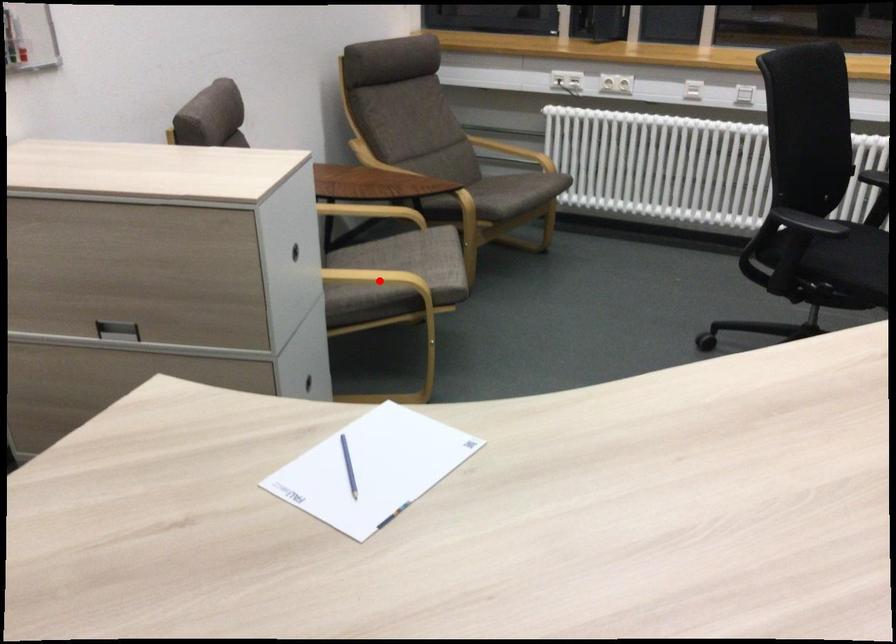
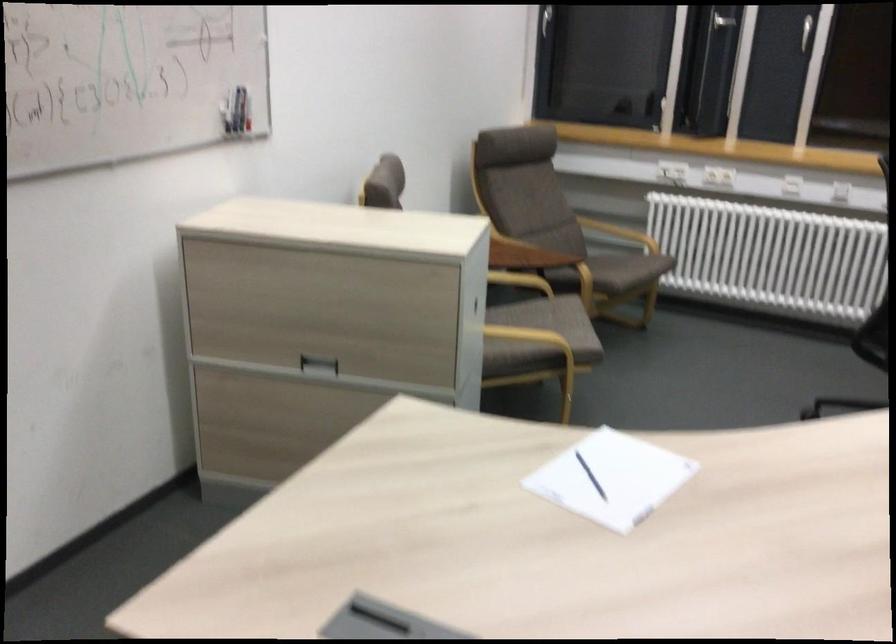
Find the pixel in the second image that matches the highlighted location in the first image.

(528, 336)